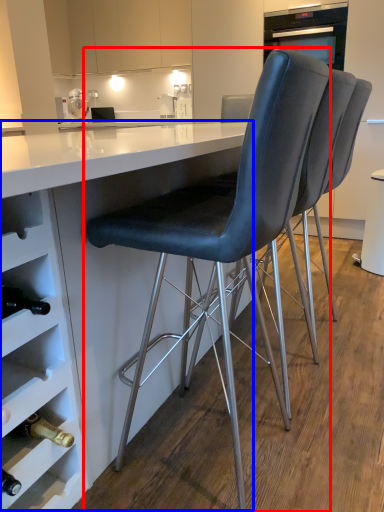
Question: Among these objects, which one is nearest to the camera, chair (highlighted by a red box) or table (highlighted by a blue box)?

Choices:
 (A) chair
 (B) table

Answer: (B)